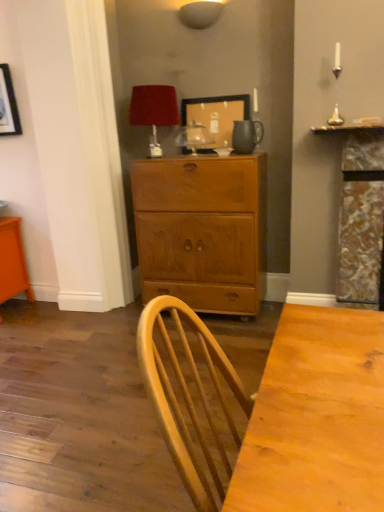
The height and width of the screenshot is (512, 384). I want to click on wooden cabinet at center, so click(x=202, y=231).

Where is `matte white lampshade at upper center, which appears as the second lamp when ordered from the bottom`? This screenshot has height=512, width=384. matte white lampshade at upper center, which appears as the second lamp when ordered from the bottom is located at coordinates click(x=201, y=13).

The width and height of the screenshot is (384, 512). Describe the element at coordinates (201, 13) in the screenshot. I see `matte white lampshade at upper center, which is the 2th lamp from left to right` at that location.

What do you see at coordinates (216, 114) in the screenshot?
I see `wooden picture frame at upper center` at bounding box center [216, 114].

The image size is (384, 512). What do you see at coordinates (246, 136) in the screenshot? I see `matte brown pitcher at upper center` at bounding box center [246, 136].

The width and height of the screenshot is (384, 512). I want to click on wooden cabinet at center, so click(x=202, y=231).

From the picture: Who is shorter, wooden cabinet at center or matte white lampshade at upper center, which appears as the second lamp when ordered from the bottom?

Standing shorter between the two is matte white lampshade at upper center, which appears as the second lamp when ordered from the bottom.

Is wooden cabinet at center situated inside matte white lampshade at upper center, the first lamp viewed from the top, or outside?

wooden cabinet at center is not inside matte white lampshade at upper center, the first lamp viewed from the top, it's outside.

Who is bigger, wooden cabinet at center or matte white lampshade at upper center, which appears as the second lamp when ordered from the bottom?

wooden cabinet at center is bigger.

Looking at this image, is wooden cabinet at center to the left or to the right of matte white lampshade at upper center, the 1th lamp when ordered from right to left, in the image?

In the image, wooden cabinet at center appears on the right side of matte white lampshade at upper center, the 1th lamp when ordered from right to left.

From a real-world perspective, between orange glossy vanity at lower left and matte brown pitcher at upper center, who is vertically higher?

matte brown pitcher at upper center, from a real-world perspective.

Which of these two, orange glossy vanity at lower left or matte brown pitcher at upper center, stands taller?

With more height is orange glossy vanity at lower left.

Is orange glossy vanity at lower left oriented towards matte brown pitcher at upper center?

No.

Which of these two, orange glossy vanity at lower left or matte brown pitcher at upper center, is bigger?

Bigger between the two is orange glossy vanity at lower left.

In the scene shown: Considering the relative positions of orange glossy vanity at lower left and matte white lampshade at upper center, which appears as the second lamp when ordered from the bottom, in the image provided, is orange glossy vanity at lower left to the left of matte white lampshade at upper center, which appears as the second lamp when ordered from the bottom, from the viewer's perspective?

Yes.

Could you tell me if orange glossy vanity at lower left is facing matte white lampshade at upper center, the first lamp viewed from the top?

No, orange glossy vanity at lower left is not turned towards matte white lampshade at upper center, the first lamp viewed from the top.

What's the angular difference between orange glossy vanity at lower left and matte white lampshade at upper center, which appears as the second lamp when ordered from the bottom,'s facing directions?

orange glossy vanity at lower left and matte white lampshade at upper center, which appears as the second lamp when ordered from the bottom, are facing 1.04 degrees away from each other.

Who is bigger, orange glossy vanity at lower left or matte white lampshade at upper center, the 1th lamp when ordered from right to left?

Bigger between the two is orange glossy vanity at lower left.

Is velvet red lampshade at upper center, the 1th lamp in the bottom-to-top sequence, wider than wooden cabinet at center?

In fact, velvet red lampshade at upper center, the 1th lamp in the bottom-to-top sequence, might be narrower than wooden cabinet at center.

How distant is velvet red lampshade at upper center, the 1th lamp in the bottom-to-top sequence, from wooden cabinet at center?

A distance of 24.49 inches exists between velvet red lampshade at upper center, the 1th lamp in the bottom-to-top sequence, and wooden cabinet at center.

From the image's perspective, is velvet red lampshade at upper center, which ranks as the second lamp in right-to-left order, positioned above or below wooden cabinet at center?

velvet red lampshade at upper center, which ranks as the second lamp in right-to-left order, is above wooden cabinet at center.

Considering the positions of objects velvet red lampshade at upper center, which appears as the 1th lamp when viewed from the left, and wooden cabinet at center in the image provided, who is more to the left, velvet red lampshade at upper center, which appears as the 1th lamp when viewed from the left, or wooden cabinet at center?

Positioned to the left is velvet red lampshade at upper center, which appears as the 1th lamp when viewed from the left.

Does matte white lampshade at upper center, the first lamp viewed from the top, contain wooden cabinet at center?

No, wooden cabinet at center is not a part of matte white lampshade at upper center, the first lamp viewed from the top.

Which object is thinner, matte white lampshade at upper center, which is the 2th lamp from left to right, or wooden cabinet at center?

With smaller width is matte white lampshade at upper center, which is the 2th lamp from left to right.

From the image's perspective, is matte white lampshade at upper center, which is the 2th lamp from left to right, located above or below wooden cabinet at center?

matte white lampshade at upper center, which is the 2th lamp from left to right, is above wooden cabinet at center.

Can you tell me how much matte white lampshade at upper center, which is the 2th lamp from left to right, and wooden cabinet at center differ in facing direction?

The angle between the facing direction of matte white lampshade at upper center, which is the 2th lamp from left to right, and the facing direction of wooden cabinet at center is 1.12 degrees.

Is velvet red lampshade at upper center, the second lamp in the top-to-bottom sequence, located within wooden cabinet at center?

No, velvet red lampshade at upper center, the second lamp in the top-to-bottom sequence, is not inside wooden cabinet at center.

From the picture: Who is more distant, wooden cabinet at center or velvet red lampshade at upper center, which appears as the 1th lamp when viewed from the left?

velvet red lampshade at upper center, which appears as the 1th lamp when viewed from the left, is further from the camera.

In terms of size, does wooden cabinet at center appear bigger or smaller than velvet red lampshade at upper center, which ranks as the second lamp in right-to-left order?

Considering their sizes, wooden cabinet at center takes up more space than velvet red lampshade at upper center, which ranks as the second lamp in right-to-left order.

Could you tell me if wooden cabinet at center is facing velvet red lampshade at upper center, which appears as the 1th lamp when viewed from the left?

No, wooden cabinet at center is not turned towards velvet red lampshade at upper center, which appears as the 1th lamp when viewed from the left.

Is wooden picture frame at upper center positioned with its back to velvet red lampshade at upper center, which ranks as the second lamp in right-to-left order?

No, wooden picture frame at upper center is not facing away from velvet red lampshade at upper center, which ranks as the second lamp in right-to-left order.

Is wooden picture frame at upper center far away from velvet red lampshade at upper center, which appears as the 1th lamp when viewed from the left?

wooden picture frame at upper center is near velvet red lampshade at upper center, which appears as the 1th lamp when viewed from the left, not far away.

This screenshot has width=384, height=512. There is a wooden picture frame at upper center. In order to click on the 1st lamp above it (from a real-world perspective) in this screenshot , I will do `click(154, 111)`.

Locate an element on the screen. the chest of drawers directly beneath the matte white lampshade at upper center, the 1th lamp when ordered from right to left (from a real-world perspective) is located at coordinates (202, 231).

At what (x,y) coordinates should I click in order to perform the action: click on pitcher above the orange glossy vanity at lower left (from a real-world perspective). Please return your answer as a coordinate pair (x, y). Looking at the image, I should click on (246, 136).

Which object lies further to the anchor point wooden picture frame at upper center, wooden cabinet at center or matte white lampshade at upper center, the first lamp viewed from the top?

The object further to wooden picture frame at upper center is wooden cabinet at center.

In the scene shown: Estimate the real-world distances between objects in this image. Which object is closer to velvet red lampshade at upper center, the second lamp in the top-to-bottom sequence, wooden cabinet at center or wooden picture frame at upper center?

wooden picture frame at upper center is closer to velvet red lampshade at upper center, the second lamp in the top-to-bottom sequence.

Estimate the real-world distances between objects in this image. Which object is closer to matte brown pitcher at upper center, velvet red lampshade at upper center, the second lamp in the top-to-bottom sequence, or matte white lampshade at upper center, which appears as the second lamp when ordered from the bottom?

Based on the image, velvet red lampshade at upper center, the second lamp in the top-to-bottom sequence, appears to be nearer to matte brown pitcher at upper center.

Looking at the image, which one is located further to velvet red lampshade at upper center, the second lamp in the top-to-bottom sequence, wooden picture frame at upper center or matte brown pitcher at upper center?

matte brown pitcher at upper center.

Based on the photo, estimate the real-world distances between objects in this image. Which object is further from velvet red lampshade at upper center, which appears as the 1th lamp when viewed from the left, matte white lampshade at upper center, which is the 2th lamp from left to right, or matte brown pitcher at upper center?

matte white lampshade at upper center, which is the 2th lamp from left to right, lies further to velvet red lampshade at upper center, which appears as the 1th lamp when viewed from the left, than the other object.

Which object lies nearer to the anchor point matte brown pitcher at upper center, wooden cabinet at center or matte white lampshade at upper center, which is the 2th lamp from left to right?

The object closer to matte brown pitcher at upper center is wooden cabinet at center.

Looking at the image, which one is located closer to wooden cabinet at center, wooden picture frame at upper center or matte white lampshade at upper center, which is the 2th lamp from left to right?

wooden picture frame at upper center lies closer to wooden cabinet at center than the other object.

From the image, which object appears to be nearer to velvet red lampshade at upper center, the second lamp in the top-to-bottom sequence, wooden cabinet at center or matte brown pitcher at upper center?

matte brown pitcher at upper center lies closer to velvet red lampshade at upper center, the second lamp in the top-to-bottom sequence, than the other object.

You are a GUI agent. You are given a task and a screenshot of the screen. Output one action in this format:
    pyautogui.click(x=<x>, y=<y>)
    Task: Click on the pitcher between velvet red lampshade at upper center, the second lamp in the top-to-bottom sequence, and wooden cabinet at center from top to bottom
    Image resolution: width=384 pixels, height=512 pixels.
    Given the screenshot: What is the action you would take?
    pos(246,136)

What are the coordinates of `lamp between matte white lampshade at upper center, the first lamp viewed from the top, and wooden picture frame at upper center vertically` in the screenshot? It's located at (x=154, y=111).

This screenshot has height=512, width=384. Find the location of `picture frame between velvet red lampshade at upper center, which ranks as the second lamp in right-to-left order, and wooden cabinet at center from top to bottom`. picture frame between velvet red lampshade at upper center, which ranks as the second lamp in right-to-left order, and wooden cabinet at center from top to bottom is located at coordinates (216, 114).

Where is `picture frame between matte white lampshade at upper center, which appears as the second lamp when ordered from the bottom, and matte brown pitcher at upper center in the up-down direction`? picture frame between matte white lampshade at upper center, which appears as the second lamp when ordered from the bottom, and matte brown pitcher at upper center in the up-down direction is located at coordinates [x=216, y=114].